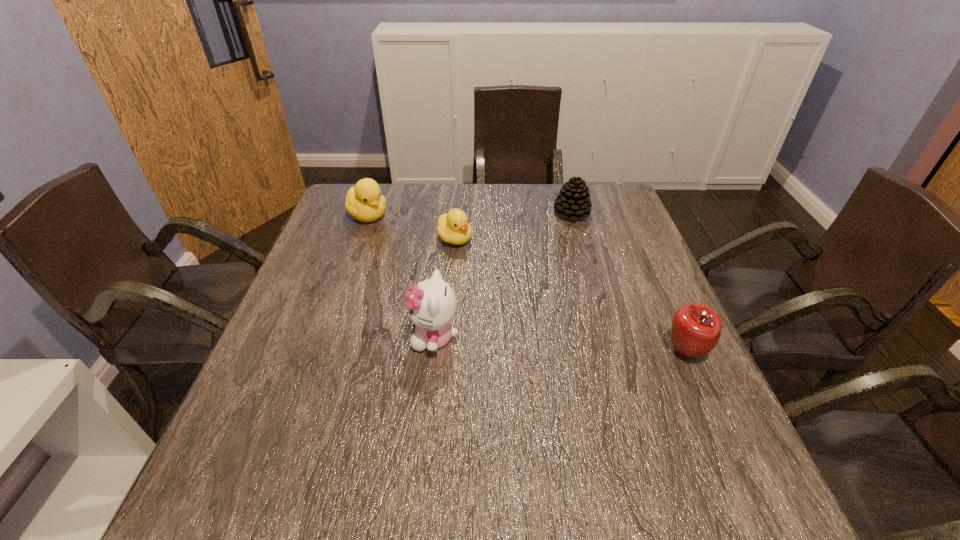
Locate an element on the screen. Image resolution: width=960 pixels, height=540 pixels. vacant space at the far left corner is located at coordinates (370, 223).

Identify the location of free space at the near left corner. This screenshot has width=960, height=540. (251, 418).

Find the location of a particular element. The height and width of the screenshot is (540, 960). vacant point at the far right corner is located at coordinates pyautogui.click(x=612, y=219).

You are a GUI agent. You are given a task and a screenshot of the screen. Output one action in this format:
    pyautogui.click(x=<x>, y=<y>)
    Task: Click on the vacant area that lies between the pinecone and the duckling
    
    Given the screenshot: What is the action you would take?
    pyautogui.click(x=514, y=226)

Find the location of a particular element. unoccupied position between the apple and the pinecone is located at coordinates (628, 282).

You are a GUI agent. You are given a task and a screenshot of the screen. Output one action in this format:
    pyautogui.click(x=<x>, y=<y>)
    Task: Click on the vacant area between the apple and the duckling
    The width and height of the screenshot is (960, 540).
    Given the screenshot: What is the action you would take?
    pyautogui.click(x=570, y=295)

The width and height of the screenshot is (960, 540). Identify the location of free space between the rightmost object and the kitten. (560, 345).

Where is `vacant point located between the second object from right to left and the kitten`? Image resolution: width=960 pixels, height=540 pixels. vacant point located between the second object from right to left and the kitten is located at coordinates pyautogui.click(x=503, y=275).

This screenshot has width=960, height=540. I want to click on free space that is in between the duck and the kitten, so click(401, 276).

Locate an element on the screen. The image size is (960, 540). free space between the pinecone and the tallest object is located at coordinates (503, 275).